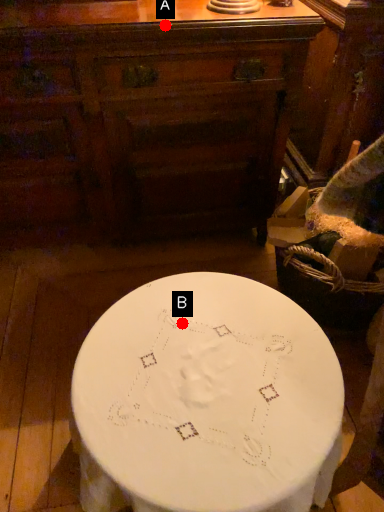
Question: Two points are circled on the image, labeled by A and B beside each circle. Which point is farther from the camera taking this photo?

Choices:
 (A) A is further
 (B) B is further

Answer: (A)